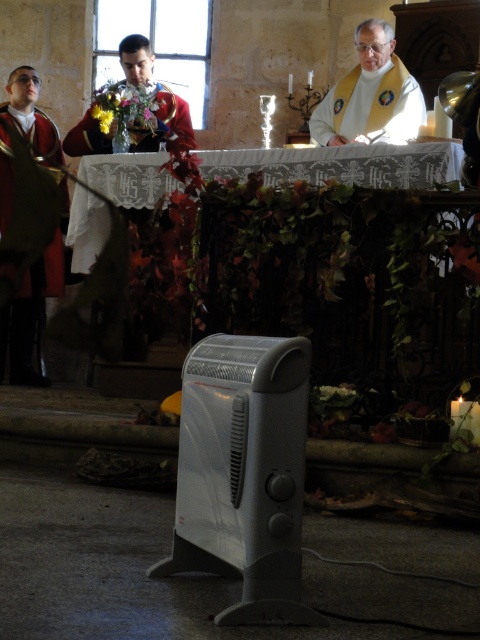
Question: In this image, where is white glossy vest at upper center located relative to matte green robe at left?

Choices:
 (A) below
 (B) above

Answer: (B)

Question: Considering the real-world distances, which object is farthest from the matte red uniform at center?

Choices:
 (A) matte green robe at left
 (B) white glossy vest at upper center

Answer: (B)

Question: Which is nearer to the white glossy vest at upper center?

Choices:
 (A) matte red uniform at center
 (B) matte green robe at left

Answer: (A)

Question: Is matte green robe at left further to camera compared to matte red uniform at center?

Choices:
 (A) yes
 (B) no

Answer: (A)

Question: Is matte green robe at left thinner than matte red uniform at center?

Choices:
 (A) no
 (B) yes

Answer: (B)

Question: Which point is closer to the camera?

Choices:
 (A) (369, 81)
 (B) (17, 112)
 (C) (133, 131)

Answer: (A)